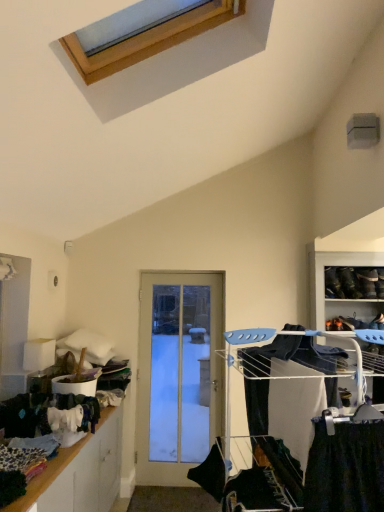
Question: Is white metal drying rack at right not close to wooden shelf at lower left?

Choices:
 (A) yes
 (B) no

Answer: (A)

Question: From the image's perspective, is white metal drying rack at right beneath wooden shelf at lower left?

Choices:
 (A) no
 (B) yes

Answer: (A)

Question: Considering the relative positions of white metal drying rack at right and wooden shelf at lower left in the image provided, is white metal drying rack at right to the right of wooden shelf at lower left from the viewer's perspective?

Choices:
 (A) no
 (B) yes

Answer: (B)

Question: Can you confirm if white metal drying rack at right is shorter than wooden shelf at lower left?

Choices:
 (A) yes
 (B) no

Answer: (B)

Question: Does white metal drying rack at right have a smaller size compared to wooden shelf at lower left?

Choices:
 (A) no
 (B) yes

Answer: (B)

Question: Considering the relative sizes of white metal drying rack at right and wooden shelf at lower left in the image provided, is white metal drying rack at right bigger than wooden shelf at lower left?

Choices:
 (A) yes
 (B) no

Answer: (B)

Question: Does black fabric at center turn towards white metal drying rack at right?

Choices:
 (A) no
 (B) yes

Answer: (A)

Question: Is black fabric at center closer to the viewer compared to white metal drying rack at right?

Choices:
 (A) yes
 (B) no

Answer: (B)

Question: Is black fabric at center completely or partially outside of white metal drying rack at right?

Choices:
 (A) no
 (B) yes

Answer: (A)

Question: From a real-world perspective, is black fabric at center positioned under white metal drying rack at right based on gravity?

Choices:
 (A) yes
 (B) no

Answer: (A)

Question: Can you confirm if black fabric at center is bigger than white metal drying rack at right?

Choices:
 (A) yes
 (B) no

Answer: (B)

Question: Is white metal drying rack at right at the back of black fabric at center?

Choices:
 (A) yes
 (B) no

Answer: (B)

Question: Are white metal drying rack at right and white glass door at center located far from each other?

Choices:
 (A) yes
 (B) no

Answer: (A)